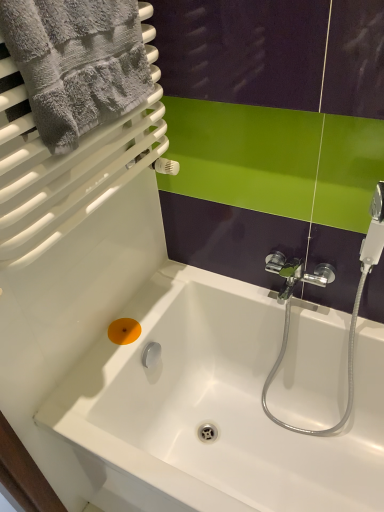
Question: In terms of height, does white glossy bathtub at center look taller or shorter compared to orange matte soap at lower left?

Choices:
 (A) tall
 (B) short

Answer: (A)

Question: Is point (167, 411) positioned closer to the camera than point (127, 333)?

Choices:
 (A) farther
 (B) closer

Answer: (A)

Question: Which of these objects is positioned farthest from the orange matte soap at lower left?

Choices:
 (A) gray fluffy towel at upper left
 (B) white glossy bathtub at center

Answer: (A)

Question: Estimate the real-world distances between objects in this image. Which object is closer to the gray fluffy towel at upper left?

Choices:
 (A) orange matte soap at lower left
 (B) white glossy bathtub at center

Answer: (A)